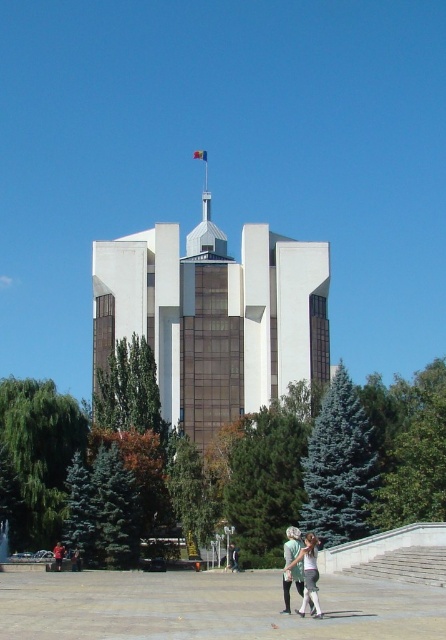
Question: Is white glass building at center below white cotton shirt at lower center?

Choices:
 (A) no
 (B) yes

Answer: (A)

Question: Can you confirm if white glass building at center is thinner than white cotton shirt at lower center?

Choices:
 (A) no
 (B) yes

Answer: (A)

Question: Is white glass building at center smaller than white cotton shirt at lower center?

Choices:
 (A) no
 (B) yes

Answer: (A)

Question: Which point is closer to the camera taking this photo?

Choices:
 (A) (180, 396)
 (B) (318, 611)

Answer: (B)